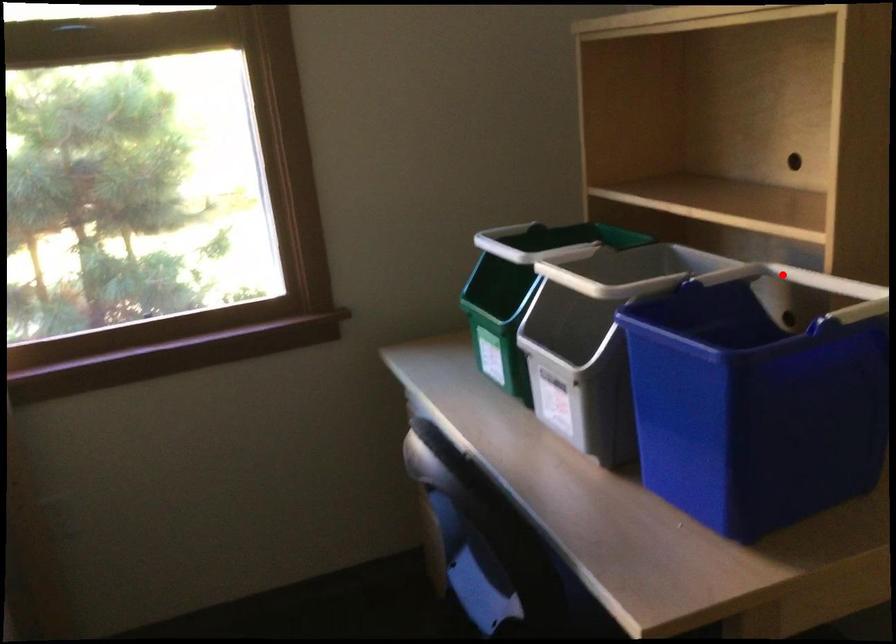
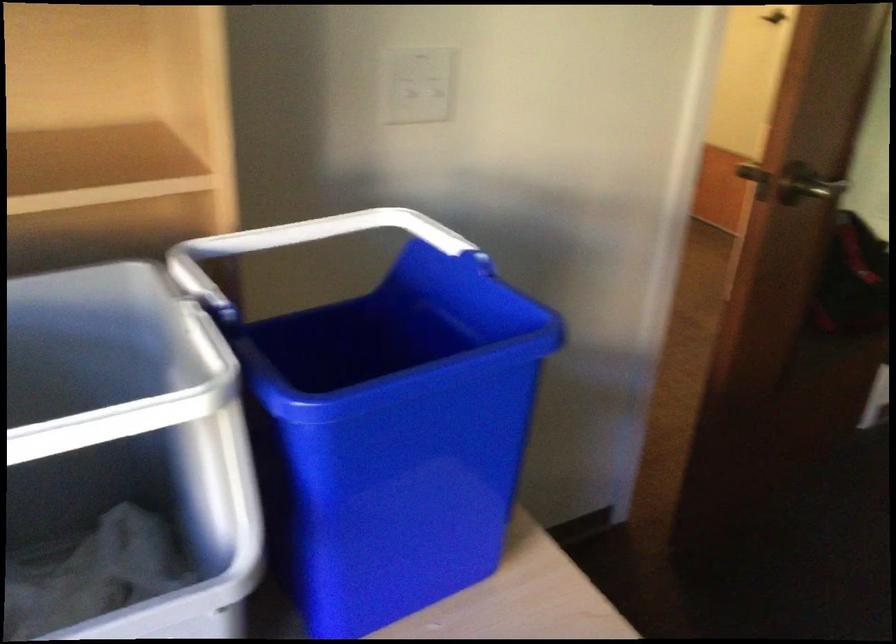
Question: A red point is marked in image1. In image2, is the corresponding 3D point closer to the camera or farther? Reply with the corresponding letter.

Choices:
 (A) The corresponding 3D point is closer.
 (B) The corresponding 3D point is farther.

Answer: (A)